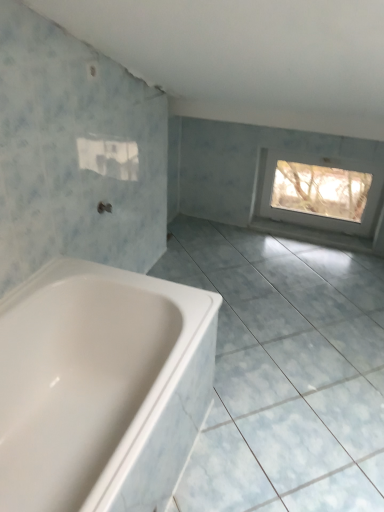
Question: Are white glossy bathtub at lower left and white glossy ceramic tile at lower left located far from each other?

Choices:
 (A) yes
 (B) no

Answer: (B)

Question: Can you confirm if white glossy bathtub at lower left is taller than white glossy ceramic tile at lower left?

Choices:
 (A) yes
 (B) no

Answer: (A)

Question: From the image's perspective, would you say white glossy bathtub at lower left is positioned over white glossy ceramic tile at lower left?

Choices:
 (A) no
 (B) yes

Answer: (A)

Question: Is white glossy bathtub at lower left positioned beyond the bounds of white glossy ceramic tile at lower left?

Choices:
 (A) yes
 (B) no

Answer: (A)

Question: From a real-world perspective, is white glossy bathtub at lower left on top of white glossy ceramic tile at lower left?

Choices:
 (A) no
 (B) yes

Answer: (B)

Question: From a real-world perspective, is white glossy bathtub at lower left located beneath white glossy ceramic tile at lower left?

Choices:
 (A) no
 (B) yes

Answer: (A)

Question: From the image's perspective, would you say white glossy ceramic tile at lower left is shown under white glossy bathtub at lower left?

Choices:
 (A) yes
 (B) no

Answer: (B)

Question: Is white glossy ceramic tile at lower left wider than white glossy bathtub at lower left?

Choices:
 (A) no
 (B) yes

Answer: (B)

Question: Considering the relative positions of white glossy ceramic tile at lower left and white glossy bathtub at lower left in the image provided, is white glossy ceramic tile at lower left in front of white glossy bathtub at lower left?

Choices:
 (A) no
 (B) yes

Answer: (A)

Question: From a real-world perspective, is white glossy ceramic tile at lower left below white glossy bathtub at lower left?

Choices:
 (A) yes
 (B) no

Answer: (A)

Question: Would you say white glossy ceramic tile at lower left contains white glossy bathtub at lower left?

Choices:
 (A) no
 (B) yes

Answer: (A)

Question: From the image's perspective, is white glossy ceramic tile at lower left over white glossy bathtub at lower left?

Choices:
 (A) no
 (B) yes

Answer: (B)

Question: Is matte silver tap at center outside of white glossy ceramic tile at lower left?

Choices:
 (A) yes
 (B) no

Answer: (A)